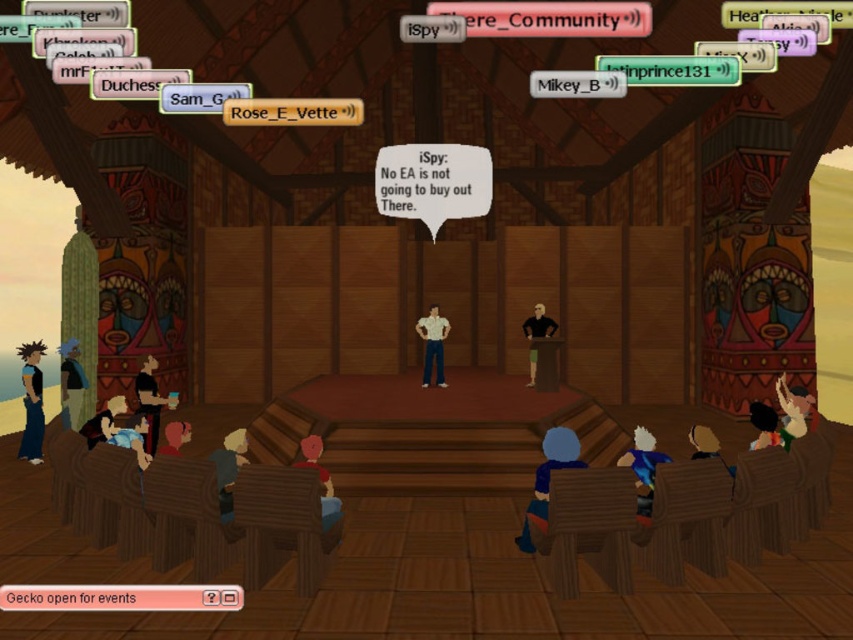
You are standing in the wooden hall and need to locate the point at coordinates (229, 467). According to the scene description, where exactly is this point located?

The point at coordinates (229, 467) is on the smooth gray shirt at lower left.

You are attending a virtual event in this hall and notice two features in the lower part of the scene. One is the multicolored fabric at lower right and the other is the matte pink hair at lower center. Which of these two items is located higher up in the image?

The multicolored fabric at lower right is positioned over matte pink hair at lower center, meaning it is higher up in the image.